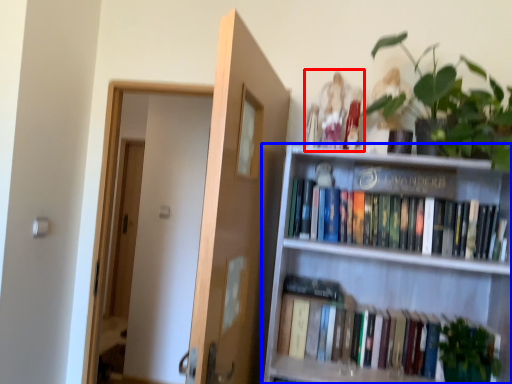
Question: Which point is further to the camera, toy (highlighted by a red box) or shelf (highlighted by a blue box)?

Choices:
 (A) toy
 (B) shelf

Answer: (A)